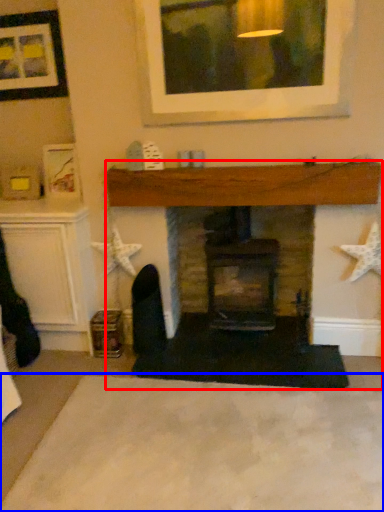
Question: Which object is closer to the camera taking this photo, fireplace (highlighted by a red box) or plain (highlighted by a blue box)?

Choices:
 (A) fireplace
 (B) plain

Answer: (B)